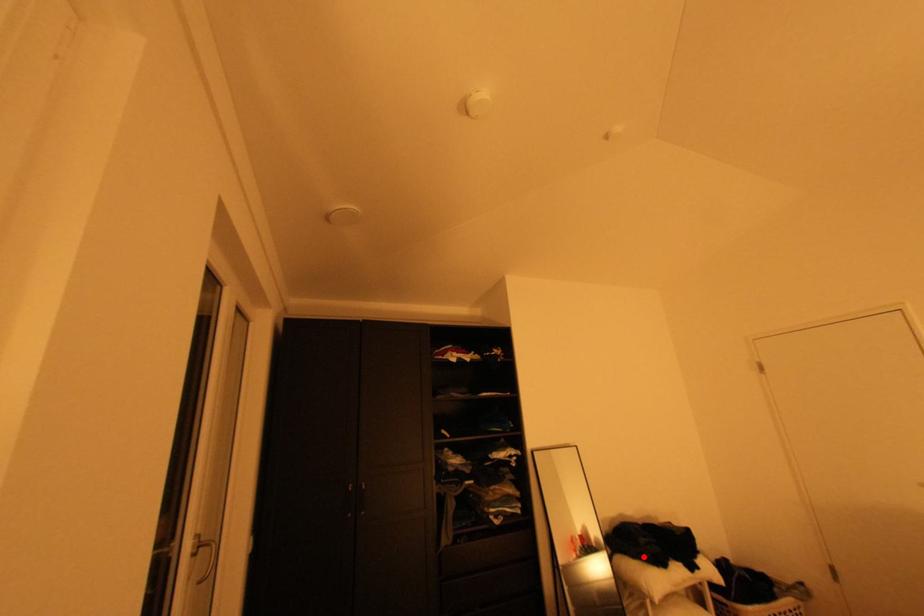
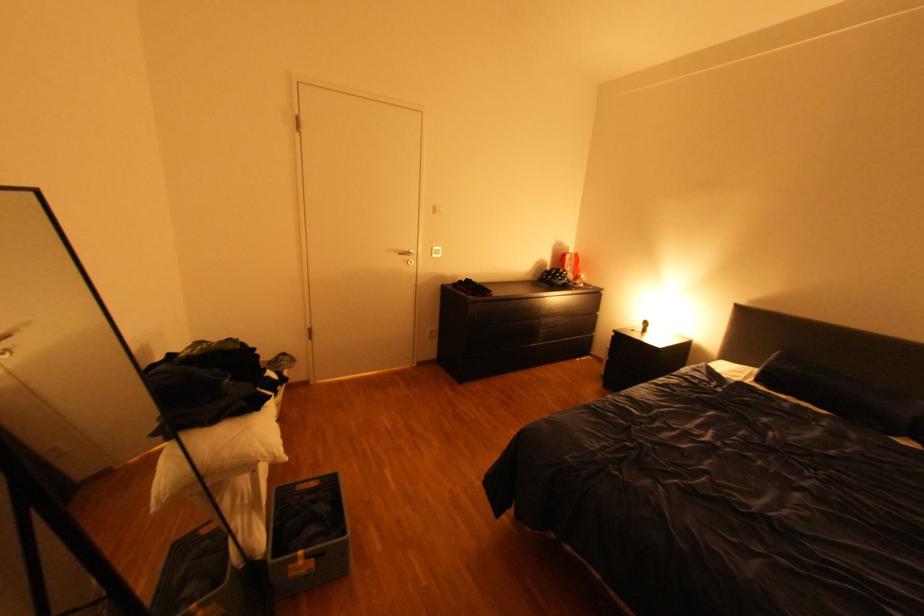
Locate, in the second image, the point that corresponds to the highlighted location in the first image.

(223, 421)